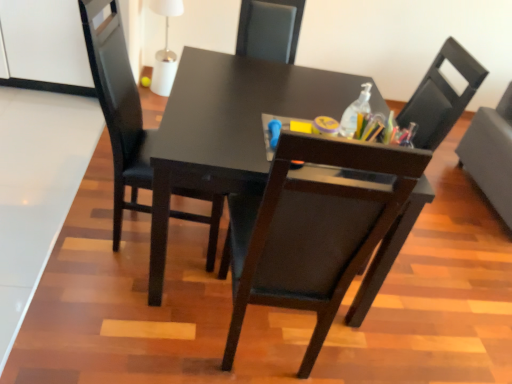
Identify the location of free spot behind clear plastic bottle at upper right. The height and width of the screenshot is (384, 512). (332, 101).